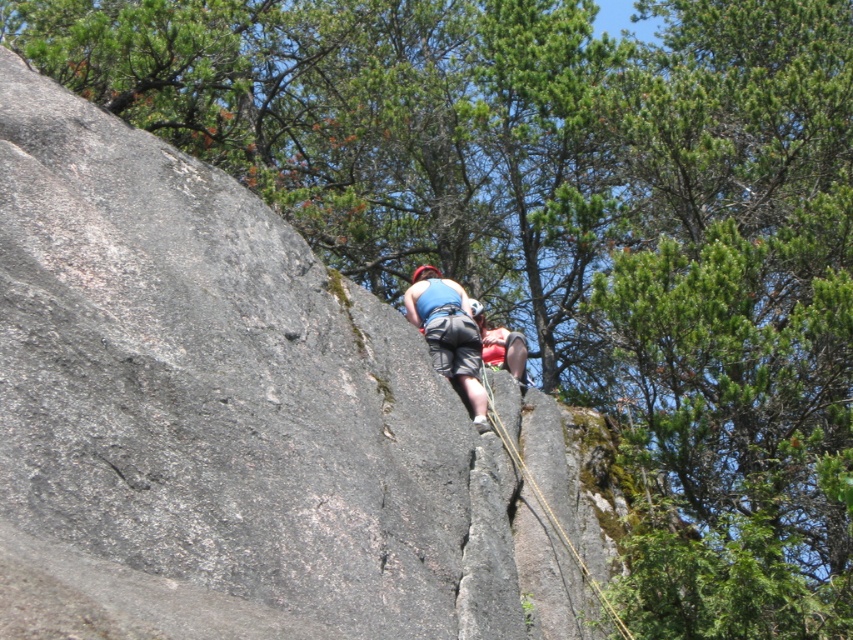
Question: Is blue fabric harness at center thinner than yellow rope at center?

Choices:
 (A) no
 (B) yes

Answer: (A)

Question: Which point is closer to the camera?

Choices:
 (A) blue fabric harness at center
 (B) yellow rope at center

Answer: (B)

Question: Does blue fabric harness at center come behind yellow rope at center?

Choices:
 (A) yes
 (B) no

Answer: (A)

Question: Which object appears farthest from the camera in this image?

Choices:
 (A) blue fabric harness at center
 (B) yellow rope at center

Answer: (A)

Question: Among these objects, which one is farthest from the camera?

Choices:
 (A) yellow rope at center
 (B) blue fabric harness at center

Answer: (B)

Question: Is blue fabric harness at center positioned behind yellow rope at center?

Choices:
 (A) no
 (B) yes

Answer: (B)